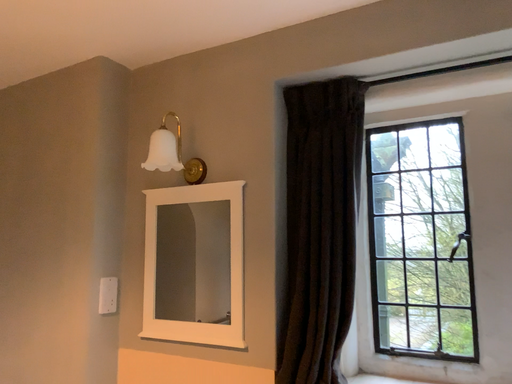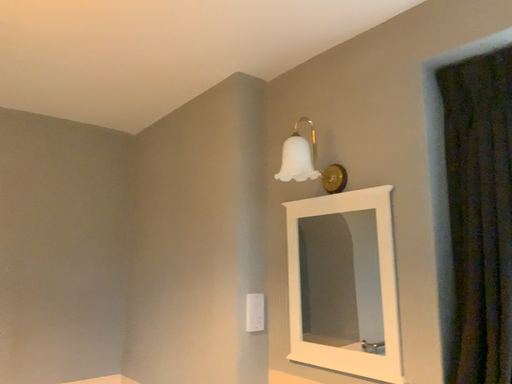
Question: Which way did the camera rotate in the video?

Choices:
 (A) rotated right
 (B) rotated left

Answer: (B)